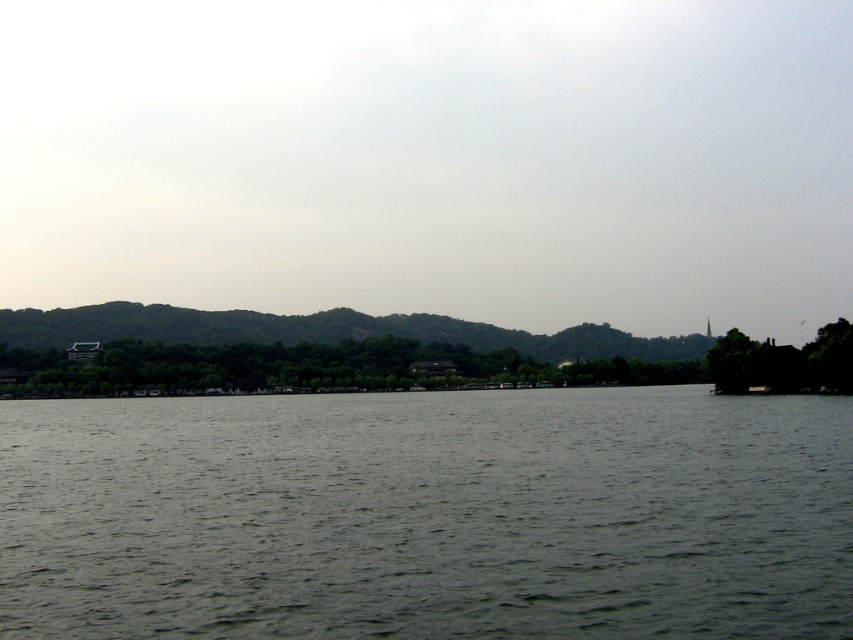
Is gray water at center smaller than green matte tree at right?

No.

Between gray water at center and green matte tree at right, which one is positioned higher?

Positioned higher is green matte tree at right.

Which is behind, point (283, 426) or point (741, 380)?

Positioned behind is point (741, 380).

At what (x,y) coordinates should I click in order to perform the action: click on gray water at center. Please return your answer as a coordinate pair (x, y). Looking at the image, I should click on (428, 515).